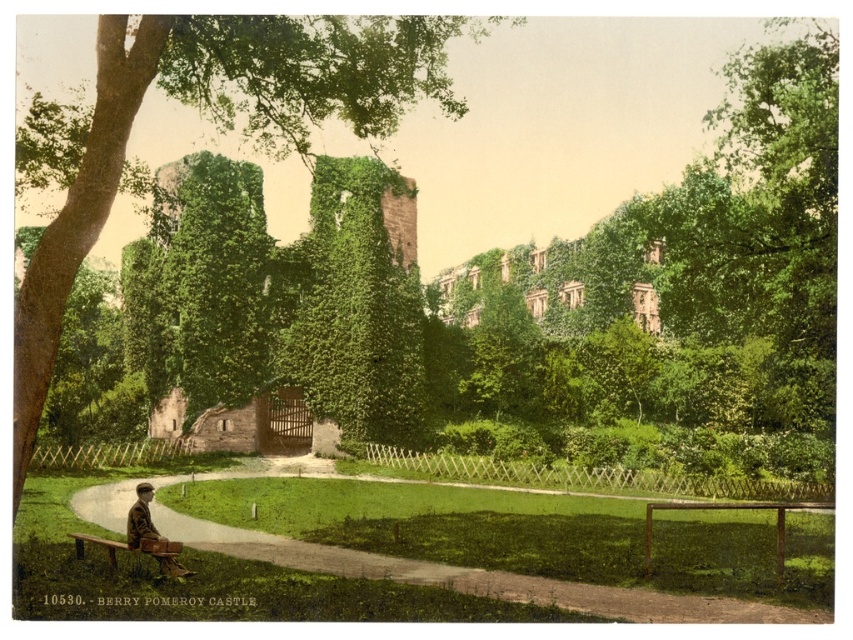
Question: Among these objects, which one is farthest from the camera?

Choices:
 (A) green ivy-covered wall at center
 (B) green leafy tree at center
 (C) wooden park bench at lower left
 (D) camouflage fabric jacket at lower left

Answer: (A)

Question: Which object is positioned closest to the green leafy tree at center?

Choices:
 (A) wooden park bench at lower left
 (B) camouflage fabric jacket at lower left

Answer: (B)

Question: Is wooden park bench at lower left to the left of camouflage fabric jacket at lower left from the viewer's perspective?

Choices:
 (A) yes
 (B) no

Answer: (B)

Question: Is green ivy-covered wall at center bigger than camouflage fabric jacket at lower left?

Choices:
 (A) no
 (B) yes

Answer: (B)

Question: Which point appears closest to the camera in this image?

Choices:
 (A) (167, 544)
 (B) (289, 300)
 (C) (373, 45)
 (D) (152, 524)

Answer: (A)

Question: Does green ivy-covered wall at center have a larger size compared to camouflage fabric jacket at lower left?

Choices:
 (A) yes
 (B) no

Answer: (A)